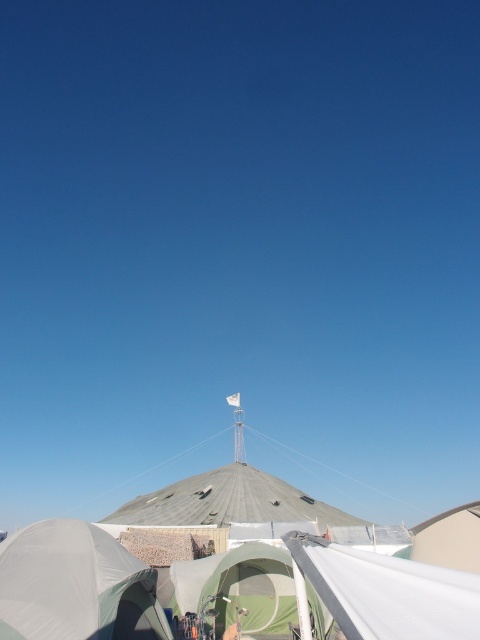
Which is below, white fabric tent at lower left or green fabric tent at center?

green fabric tent at center is lower down.

Which is behind, point (2, 609) or point (288, 572)?

The point (288, 572) is more distant.

You are a GUI agent. You are given a task and a screenshot of the screen. Output one action in this format:
    pyautogui.click(x=<x>, y=<y>)
    Task: Click on the white fabric tent at lower left
    This screenshot has width=480, height=640.
    Given the screenshot: What is the action you would take?
    pyautogui.click(x=75, y=586)

Is white fabric tent at center bigger than white matte canopy at lower right?

Yes, white fabric tent at center is bigger than white matte canopy at lower right.

Is point (82, 563) positioned behind point (470, 582)?

Yes, it is behind point (470, 582).

At what (x,y) coordinates should I click in order to perform the action: click on white fabric tent at center. Please return your answer as a coordinate pair (x, y). This screenshot has height=640, width=480. Looking at the image, I should click on coord(222,570).

Can you confirm if white matte canopy at lower right is smaller than green fabric tent at center?

Indeed, white matte canopy at lower right has a smaller size compared to green fabric tent at center.

Is white matte canopy at lower right wider than green fabric tent at center?

Incorrect, white matte canopy at lower right's width does not surpass green fabric tent at center's.

Measure the distance between white matte canopy at lower right and camera.

white matte canopy at lower right is 2.29 meters away from camera.

The width and height of the screenshot is (480, 640). I want to click on white matte canopy at lower right, so click(x=387, y=593).